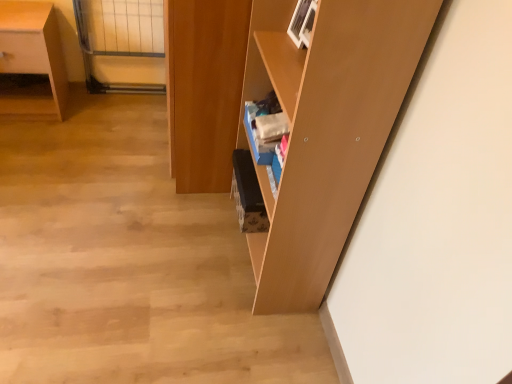
Question: Can you confirm if clear glass door at upper left is bigger than matte wood desk at left?

Choices:
 (A) yes
 (B) no

Answer: (B)

Question: Is clear glass door at upper left located outside matte wood desk at left?

Choices:
 (A) no
 (B) yes

Answer: (B)

Question: Considering the relative positions of clear glass door at upper left and matte wood desk at left in the image provided, is clear glass door at upper left to the right of matte wood desk at left from the viewer's perspective?

Choices:
 (A) no
 (B) yes

Answer: (B)

Question: Is matte wood desk at left inside clear glass door at upper left?

Choices:
 (A) yes
 (B) no

Answer: (B)

Question: Is clear glass door at upper left positioned in front of matte wood desk at left?

Choices:
 (A) no
 (B) yes

Answer: (A)

Question: Is clear glass door at upper left to the left of matte wood desk at left from the viewer's perspective?

Choices:
 (A) yes
 (B) no

Answer: (B)

Question: Considering the relative sizes of matte wood shelf at center and matte wood desk at left in the image provided, is matte wood shelf at center smaller than matte wood desk at left?

Choices:
 (A) no
 (B) yes

Answer: (A)

Question: Is matte wood shelf at center turned away from matte wood desk at left?

Choices:
 (A) no
 (B) yes

Answer: (A)

Question: Considering the relative positions of matte wood shelf at center and matte wood desk at left in the image provided, is matte wood shelf at center in front of matte wood desk at left?

Choices:
 (A) no
 (B) yes

Answer: (B)

Question: From a real-world perspective, is matte wood shelf at center over matte wood desk at left?

Choices:
 (A) no
 (B) yes

Answer: (B)

Question: Can we say matte wood shelf at center lies outside matte wood desk at left?

Choices:
 (A) yes
 (B) no

Answer: (A)

Question: From the image's perspective, is matte wood shelf at center located above matte wood desk at left?

Choices:
 (A) yes
 (B) no

Answer: (B)

Question: From the image's perspective, would you say wooden cabinet at center is shown under matte wood desk at left?

Choices:
 (A) no
 (B) yes

Answer: (B)